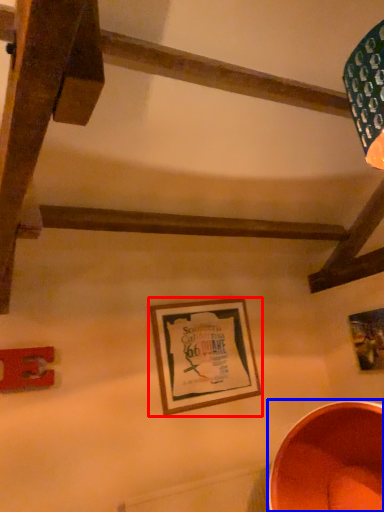
Question: Which point is closer to the camera, picture frame (highlighted by a red box) or basin (highlighted by a blue box)?

Choices:
 (A) picture frame
 (B) basin

Answer: (B)